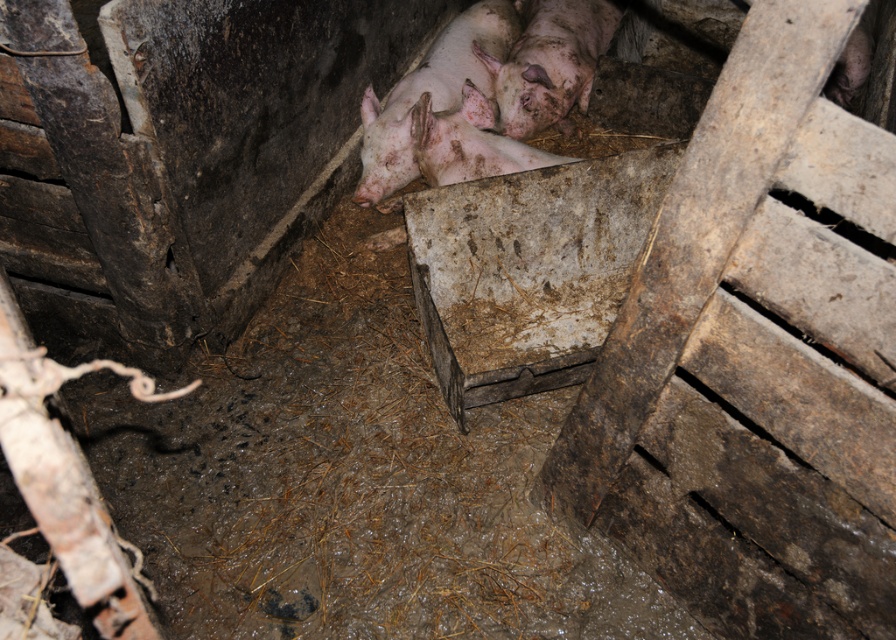
Can you confirm if pinkish muddy pig at center is positioned to the left of pinkish muddy pig at upper center?

Indeed, pinkish muddy pig at center is positioned on the left side of pinkish muddy pig at upper center.

Describe the element at coordinates (429, 93) in the screenshot. This screenshot has width=896, height=640. I see `pinkish muddy pig at center` at that location.

Where is `pinkish muddy pig at center`? pinkish muddy pig at center is located at coordinates (429, 93).